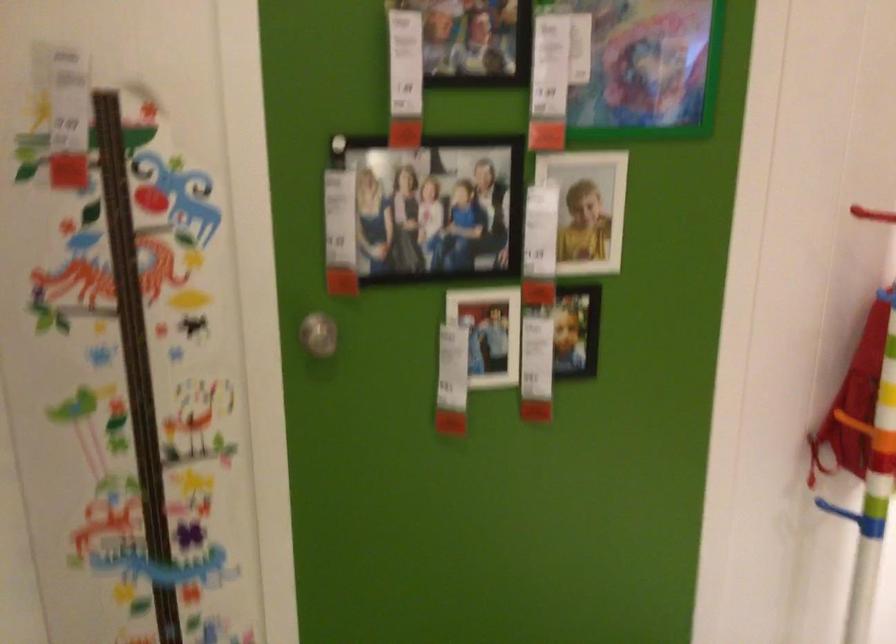
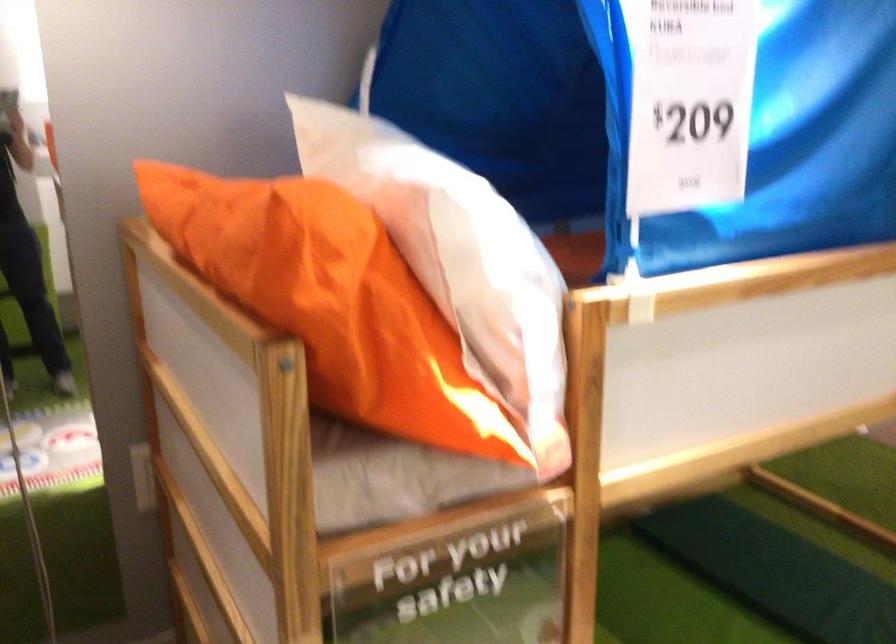
Looking at this image, the first image is from the beginning of the video and the second image is from the end. How did the camera likely rotate when shooting the video?

The camera's rotation is toward right-down.